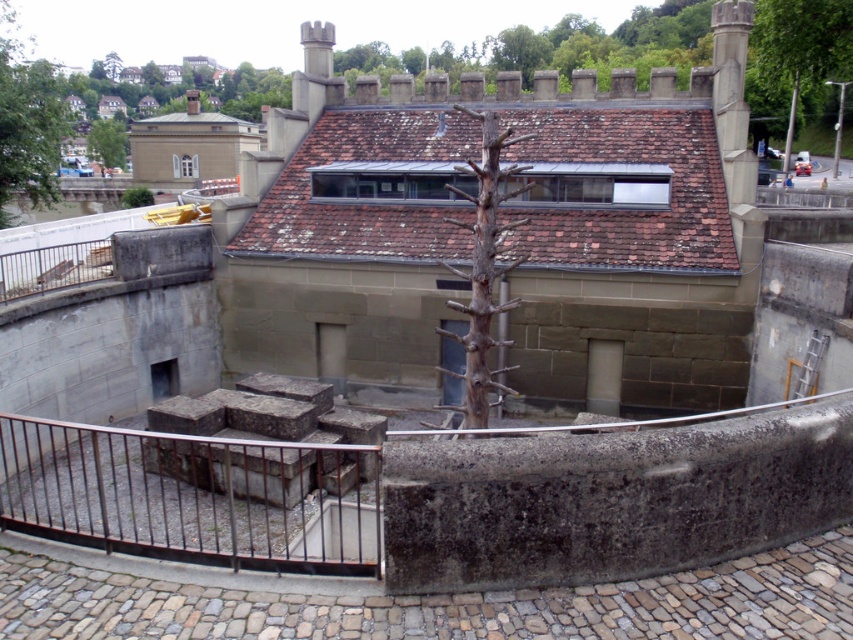
Is rusty metal railing at lower left closer to the viewer compared to green leafy tree at upper left?

That is True.

Is rusty metal railing at lower left above green leafy tree at upper left?

Incorrect, rusty metal railing at lower left is not positioned above green leafy tree at upper left.

Does point (335, 500) come in front of point (33, 65)?

Yes, it is in front of point (33, 65).

This screenshot has width=853, height=640. I want to click on rusty metal railing at lower left, so click(x=190, y=497).

Who is lower down, rusty metal railing at lower left or bare wood tree at upper center?

Positioned lower is rusty metal railing at lower left.

Between rusty metal railing at lower left and bare wood tree at upper center, which one is positioned higher?

bare wood tree at upper center is higher up.

Is point (257, 468) positioned behind point (96, 128)?

No, it is in front of (96, 128).

You are a GUI agent. You are given a task and a screenshot of the screen. Output one action in this format:
    pyautogui.click(x=<x>, y=<y>)
    Task: Click on the rusty metal railing at lower left
    The width and height of the screenshot is (853, 640).
    Given the screenshot: What is the action you would take?
    pyautogui.click(x=190, y=497)

Between rusty metal railing at lower left and brown rough wood tree at center, which one has less height?

brown rough wood tree at center

Who is taller, rusty metal railing at lower left or brown rough wood tree at center?

rusty metal railing at lower left

What do you see at coordinates (190, 497) in the screenshot?
I see `rusty metal railing at lower left` at bounding box center [190, 497].

Find the location of a particular element. Image resolution: width=853 pixels, height=640 pixels. rusty metal railing at lower left is located at coordinates [x=190, y=497].